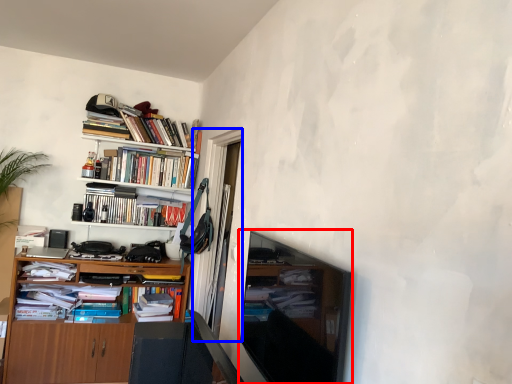
Question: Which object appears closest to the camera in this image, television (highlighted by a red box) or glass door (highlighted by a blue box)?

Choices:
 (A) television
 (B) glass door

Answer: (A)